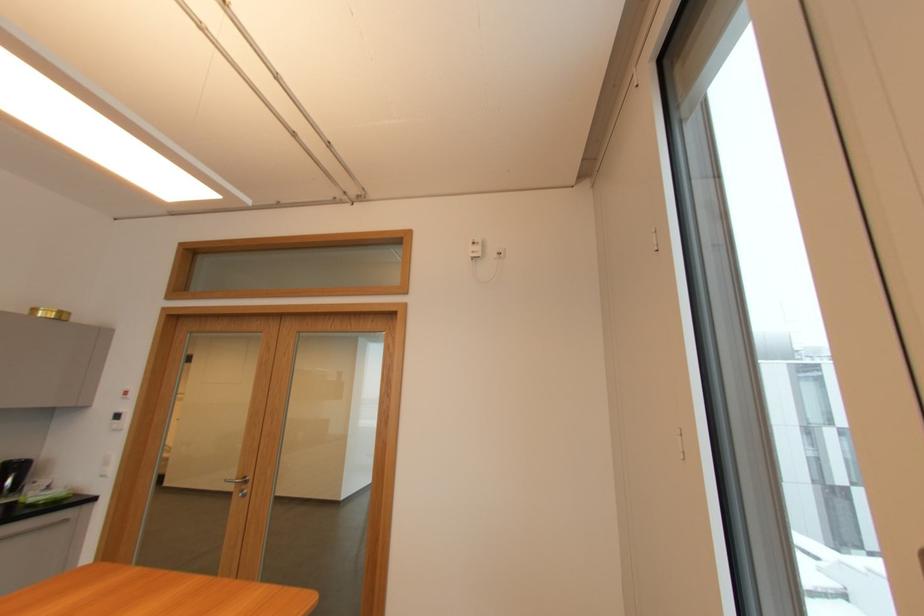
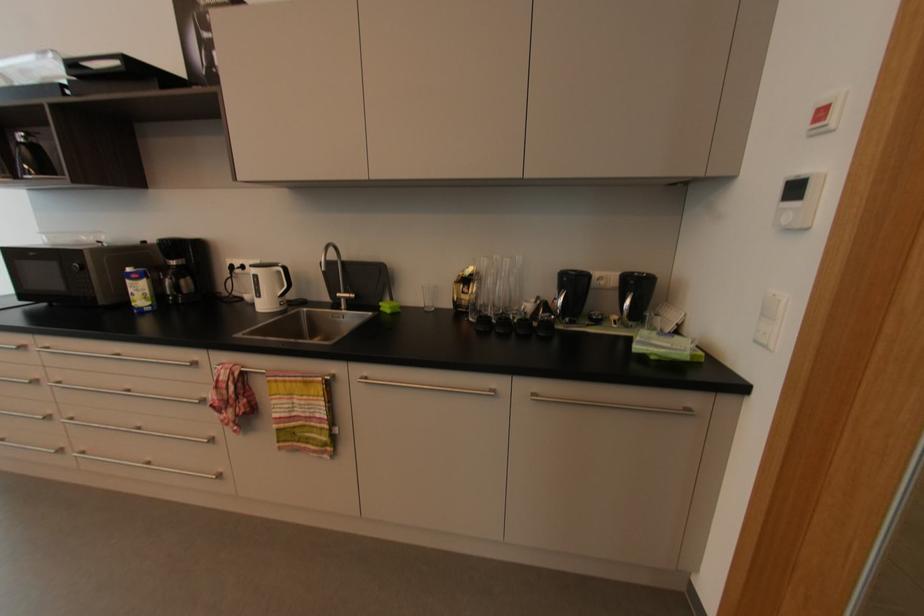
In the second image, find the point that corresponds to [110,476] in the first image.

(769, 347)